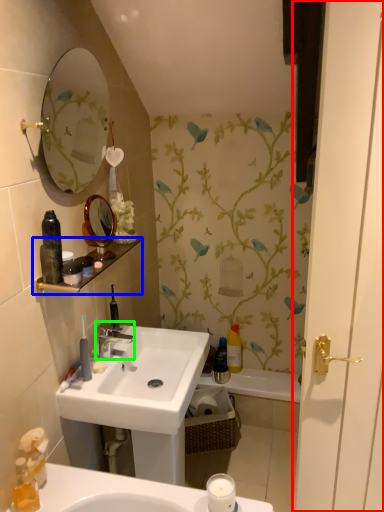
Question: Which object is the farthest from screen door (highlighted by a red box)? Choose among these: balustrade (highlighted by a blue box) or tap (highlighted by a green box).

Choices:
 (A) balustrade
 (B) tap

Answer: (B)